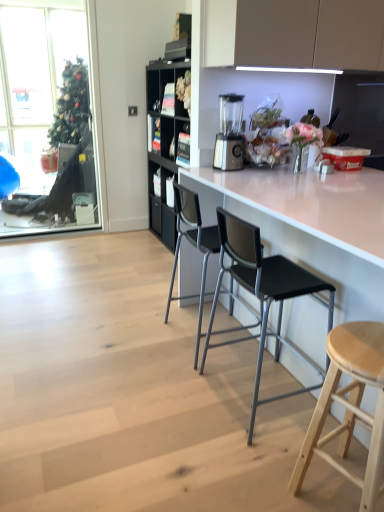
You are a GUI agent. You are given a task and a screenshot of the screen. Output one action in this format:
    pyautogui.click(x=<x>, y=<y>)
    Task: Click on the free location in front of black plastic chair at center, the 1th chair in the back-to-front sequence
    This screenshot has height=512, width=384.
    Given the screenshot: What is the action you would take?
    pyautogui.click(x=170, y=379)